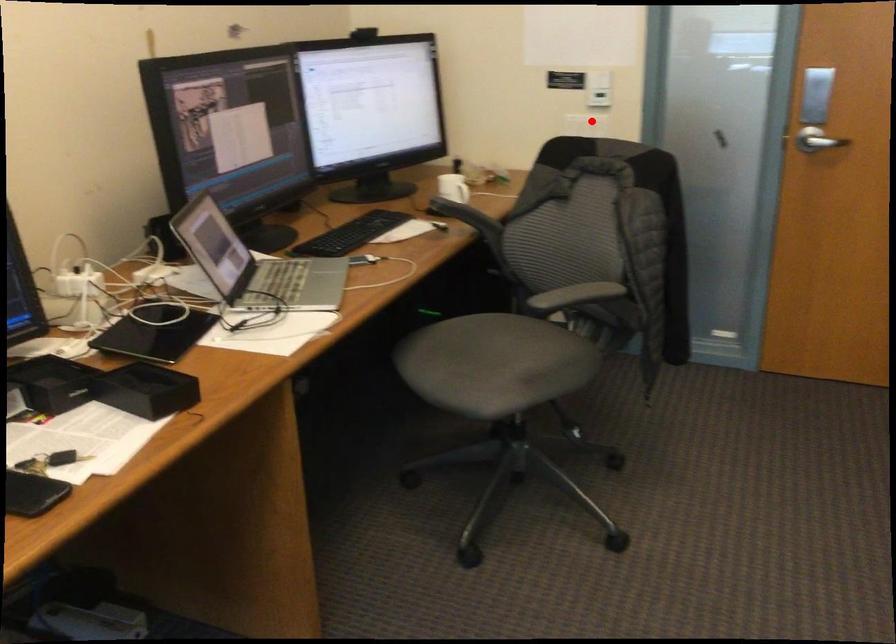
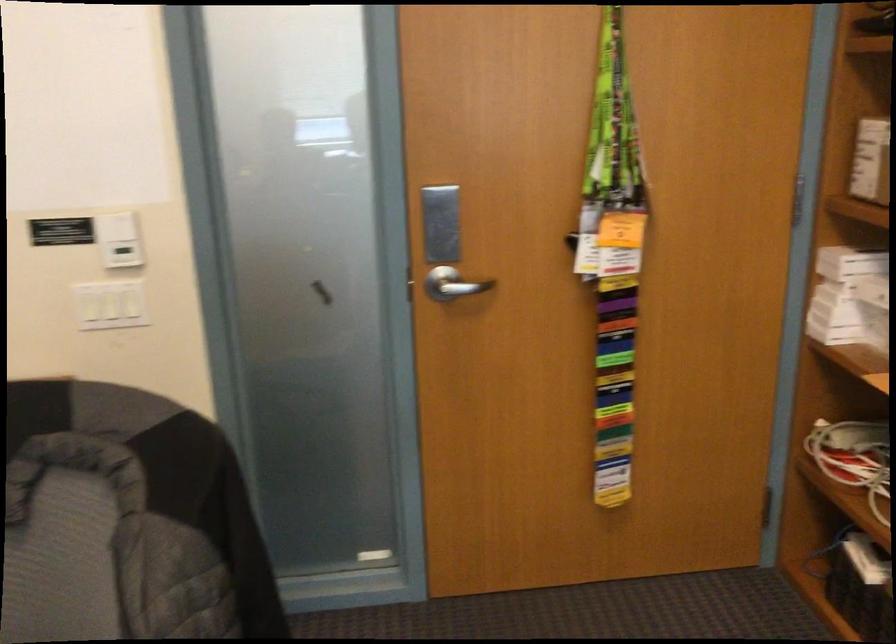
Find the pixel in the second image that matches the highlighted location in the first image.

(109, 305)